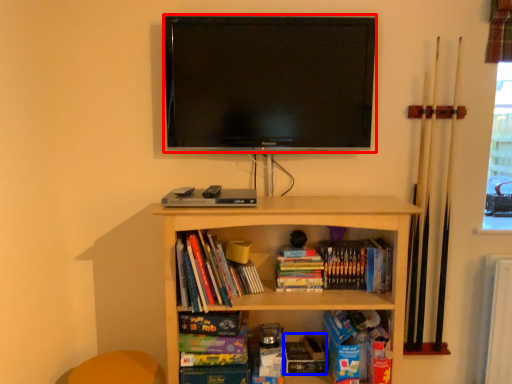
Question: Among these objects, which one is nearest to the camera, television (highlighted by a red box) or paperback book (highlighted by a blue box)?

Choices:
 (A) television
 (B) paperback book

Answer: (A)